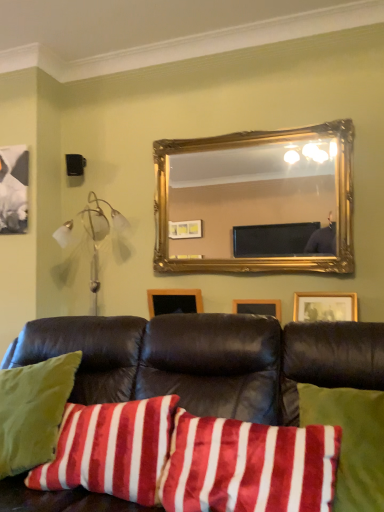
Question: From the image's perspective, is gold ornate mirror at upper center located beneath wooden picture frame at center?

Choices:
 (A) no
 (B) yes

Answer: (A)

Question: Is gold ornate mirror at upper center outside wooden picture frame at center?

Choices:
 (A) yes
 (B) no

Answer: (A)

Question: From a real-world perspective, is gold ornate mirror at upper center beneath wooden picture frame at center?

Choices:
 (A) no
 (B) yes

Answer: (A)

Question: From a real-world perspective, is gold ornate mirror at upper center located higher than wooden picture frame at center?

Choices:
 (A) no
 (B) yes

Answer: (B)

Question: Considering the relative sizes of gold ornate mirror at upper center and wooden picture frame at center in the image provided, is gold ornate mirror at upper center taller than wooden picture frame at center?

Choices:
 (A) yes
 (B) no

Answer: (A)

Question: Is wooden picture frame at center inside or outside of velvet black couch at center?

Choices:
 (A) inside
 (B) outside

Answer: (B)

Question: From the image's perspective, is wooden picture frame at center located above or below velvet black couch at center?

Choices:
 (A) above
 (B) below

Answer: (A)

Question: In terms of width, does wooden picture frame at center look wider or thinner when compared to velvet black couch at center?

Choices:
 (A) wide
 (B) thin

Answer: (B)

Question: From a real-world perspective, relative to velvet black couch at center, is wooden picture frame at center vertically above or below?

Choices:
 (A) above
 (B) below

Answer: (A)

Question: In terms of height, does velvet black couch at center look taller or shorter compared to white glass lamp at left?

Choices:
 (A) short
 (B) tall

Answer: (B)

Question: From a real-world perspective, is velvet black couch at center above or below white glass lamp at left?

Choices:
 (A) below
 (B) above

Answer: (A)

Question: Considering their positions, is velvet black couch at center located in front of or behind white glass lamp at left?

Choices:
 (A) front
 (B) behind

Answer: (A)

Question: Is velvet black couch at center spatially inside white glass lamp at left, or outside of it?

Choices:
 (A) inside
 (B) outside

Answer: (B)

Question: From the image's perspective, is gold ornate mirror at upper center positioned above or below velvety red and white striped pillow at lower left, arranged as the second pillow when viewed from the right?

Choices:
 (A) below
 (B) above

Answer: (B)

Question: Is gold ornate mirror at upper center bigger or smaller than velvety red and white striped pillow at lower left, which is the 1th pillow in left-to-right order?

Choices:
 (A) big
 (B) small

Answer: (A)